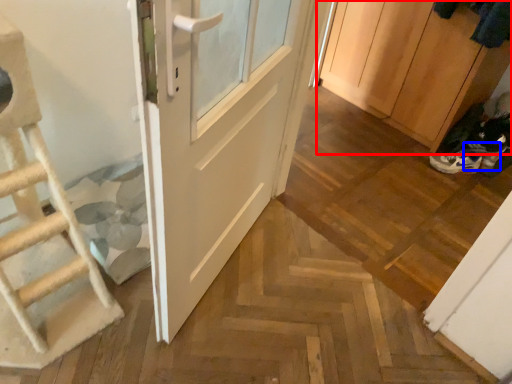
Question: Which of the following is the closest to the observer, cabinetry (highlighted by a red box) or shoe (highlighted by a blue box)?

Choices:
 (A) cabinetry
 (B) shoe

Answer: (A)